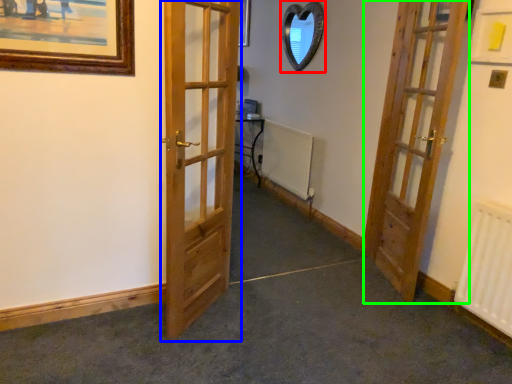
Question: Which object is positioned closest to mirror (highlighted by a red box)? Select from door (highlighted by a blue box) and door (highlighted by a green box).

Choices:
 (A) door
 (B) door

Answer: (B)